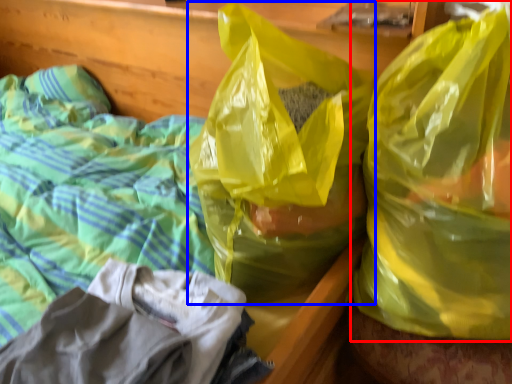
Question: Among these objects, which one is farthest to the camera, plastic bag (highlighted by a red box) or plastic bag (highlighted by a blue box)?

Choices:
 (A) plastic bag
 (B) plastic bag

Answer: (B)